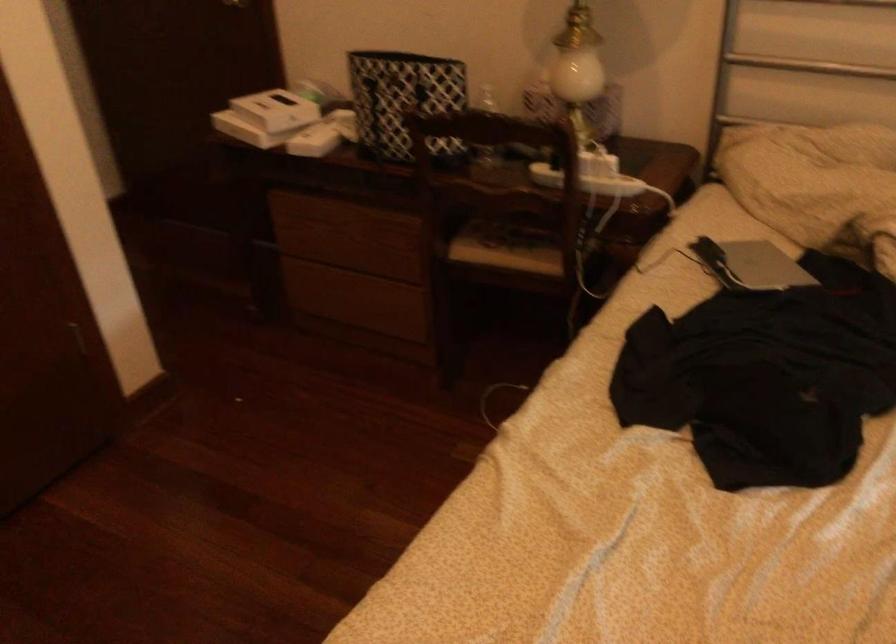
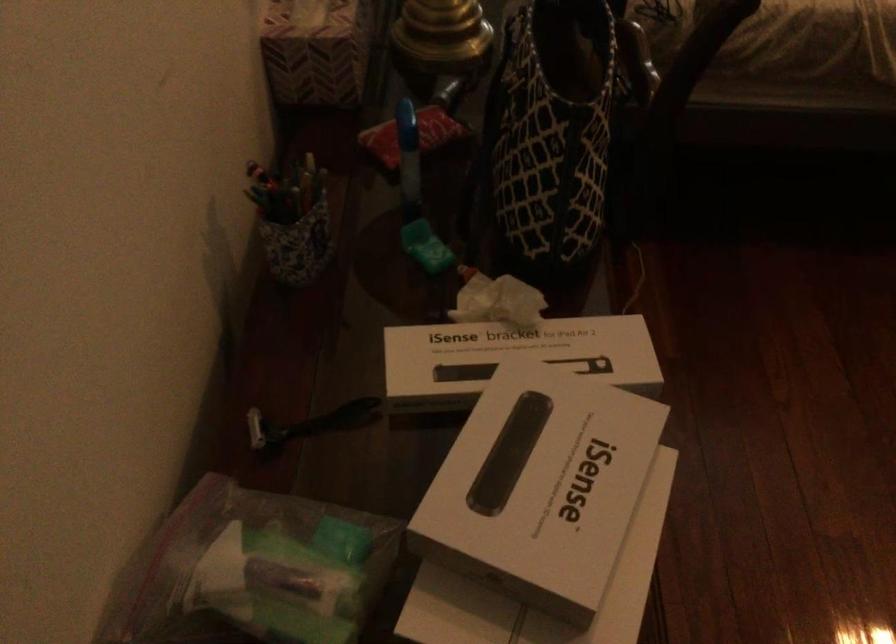
Where in the second image is the point corresponding to [312,104] from the first image?

(515, 353)